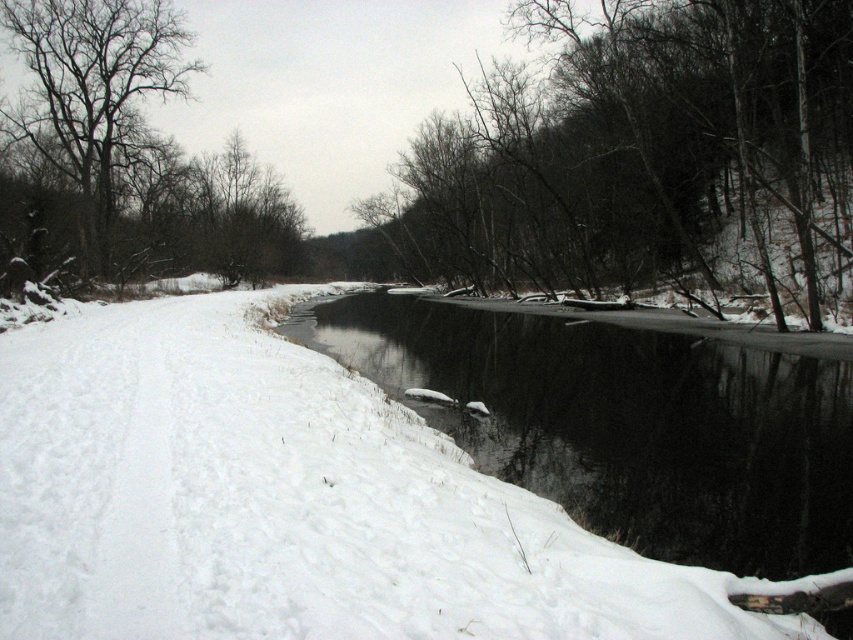
Question: Which object is closer to the camera taking this photo?

Choices:
 (A) dark brown bark tree at center
 (B) black ice at center

Answer: (B)

Question: Is dark brown bark tree at center further to the viewer compared to bare branches at left?

Choices:
 (A) yes
 (B) no

Answer: (B)

Question: Estimate the real-world distances between objects in this image. Which object is farther from the dark brown bark tree at center?

Choices:
 (A) black ice at center
 (B) bare branches at left

Answer: (B)

Question: Is dark brown bark tree at center below bare branches at left?

Choices:
 (A) no
 (B) yes

Answer: (B)

Question: Does dark brown bark tree at center have a smaller size compared to black ice at center?

Choices:
 (A) no
 (B) yes

Answer: (A)

Question: Which object appears farthest from the camera in this image?

Choices:
 (A) black ice at center
 (B) bare branches at left
 (C) dark brown bark tree at center

Answer: (B)